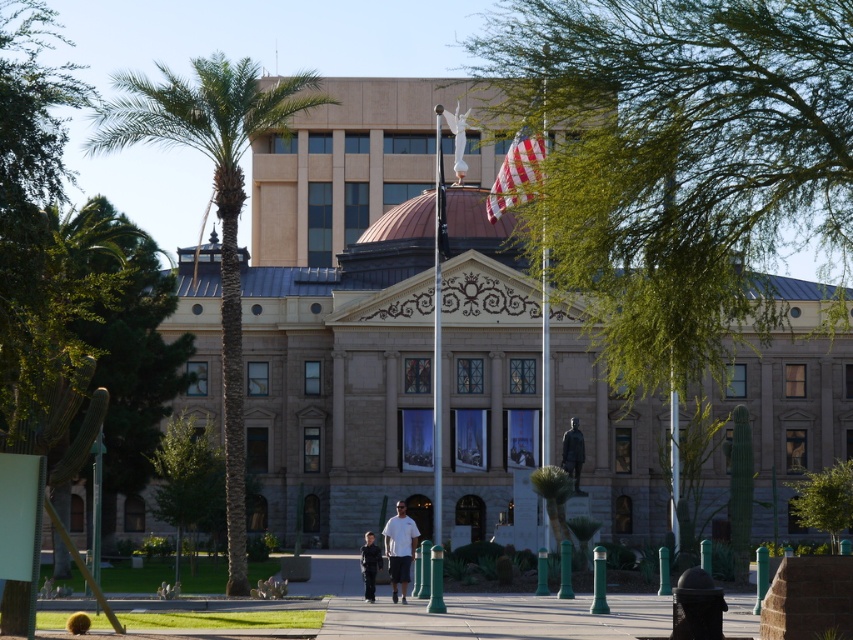
You are a photographer planning to take a picture of the green leafy palm tree at left and the bronze statue at center from the front of the building. Which object will appear larger in the photo?

The green leafy palm tree at left will appear larger in the photo because it is bigger than the bronze statue at center.

You are a photographer positioned at the front of the grand building. You want to capture both the matte white shirt at center and the bronze statue at center in a single photo. Which object should you focus on first to ensure both are in frame?

The matte white shirt at center is larger in size than the bronze statue at center, so you should focus on the matte white shirt at center first to ensure both are in frame.

You are a photographer positioned at the entrance of the building. You want to capture a photo that includes both the matte white shirt at center and the bronze statue at center. Given that the camera can only focus on objects within a 3 meter width, will both objects fit within the frame?

The matte white shirt at center is larger in width than the bronze statue at center. Since the camera can only focus on objects within a 3 meter width, the total width of both objects combined may exceed the camera frame limit. However, since both are at the center, they might be positioned close enough to fit within the 3 meter width. Without exact measurements, it is uncertain. But according to the description, the white shirt is wider than the statue, but their combined width could still be under 3m. The